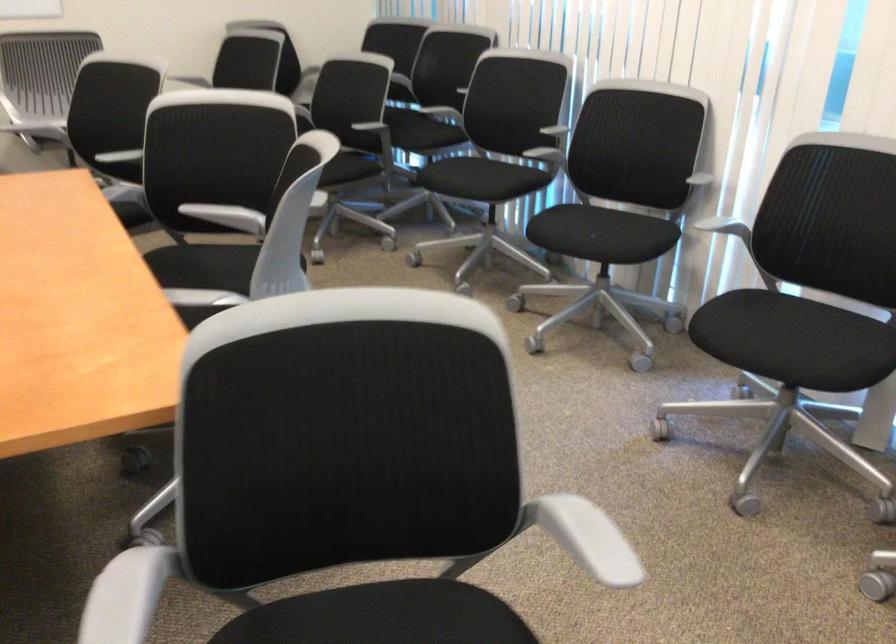
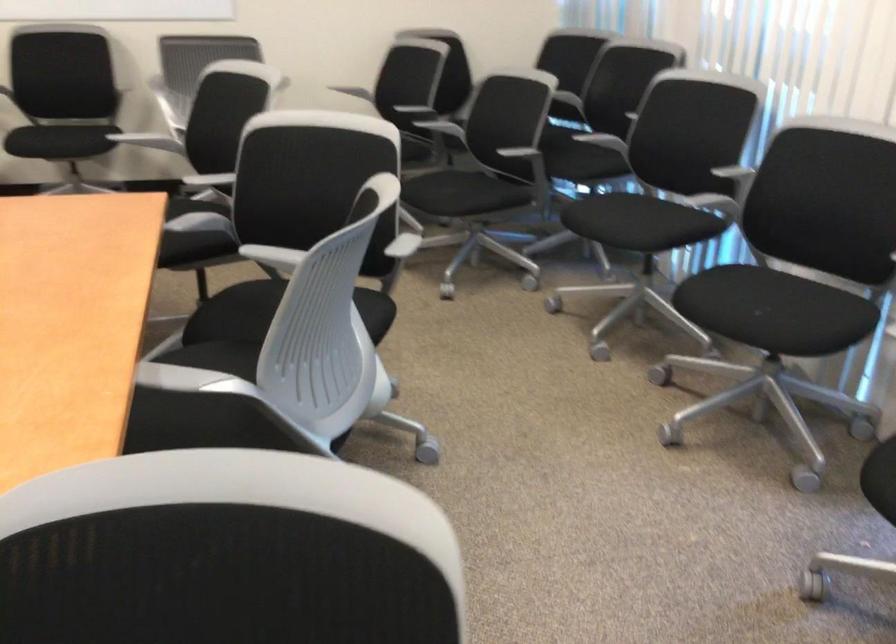
The point at [424,122] is marked in the first image. Where is the corresponding point in the second image?

(588, 147)